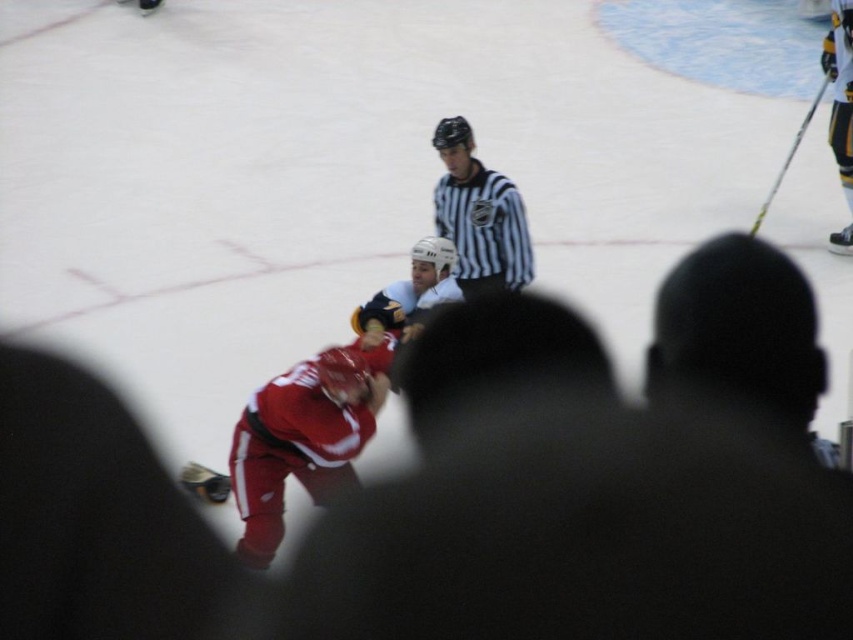
You are a spectator sitting in the stands watching the ice hockey game. You notice two points marked on the ice rink at coordinates point [444,129] and point [776,176]. Which point is closer to your viewpoint?

Point [444,129] is closer to the camera than point [776,176], so the point closer to your viewpoint is point [444,129].

You are an ice hockey player holding the black metallic hockey stick at upper right. You want to pass the puck to your teammate wearing the striped jersey at center. Can you reach the puck to them without moving from your current position?

The striped jersey at center is 2.33 meters away from the black metallic hockey stick at upper right. Since the average passing distance for a hockey player is around 20 to 30 meters, you can easily reach them without moving from your current position.